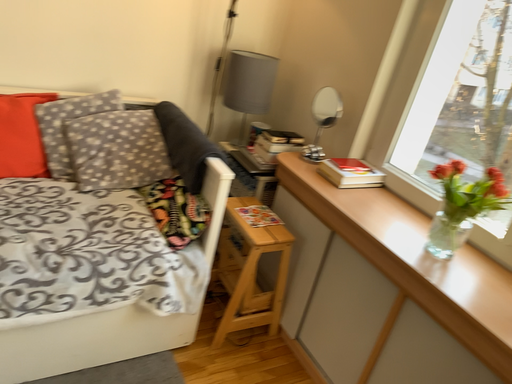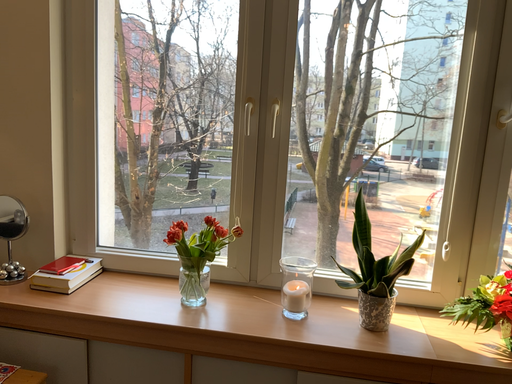
Question: Which way did the camera rotate in the video?

Choices:
 (A) rotated left
 (B) rotated right

Answer: (B)